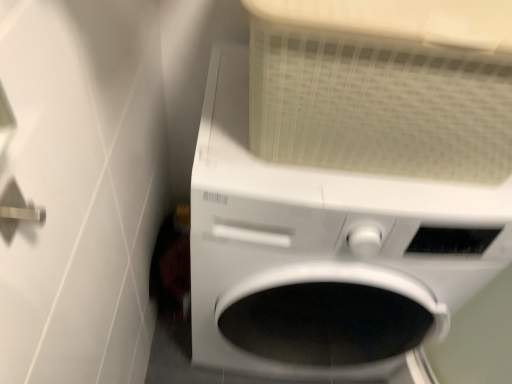
Question: From a real-world perspective, is silver metallic door handle at upper left physically above white matte washing machine at center?

Choices:
 (A) no
 (B) yes

Answer: (B)

Question: Does silver metallic door handle at upper left appear on the right side of white matte washing machine at center?

Choices:
 (A) yes
 (B) no

Answer: (B)

Question: Can you confirm if silver metallic door handle at upper left is positioned to the left of white matte washing machine at center?

Choices:
 (A) no
 (B) yes

Answer: (B)

Question: From the image's perspective, is silver metallic door handle at upper left on white matte washing machine at center?

Choices:
 (A) yes
 (B) no

Answer: (A)

Question: Are silver metallic door handle at upper left and white matte washing machine at center far apart?

Choices:
 (A) yes
 (B) no

Answer: (B)

Question: Is the depth of silver metallic door handle at upper left less than that of white matte washing machine at center?

Choices:
 (A) yes
 (B) no

Answer: (A)

Question: Does white matte washing machine at center contain silver metallic door handle at upper left?

Choices:
 (A) yes
 (B) no

Answer: (B)

Question: Does white matte washing machine at center have a smaller size compared to silver metallic door handle at upper left?

Choices:
 (A) no
 (B) yes

Answer: (A)

Question: From a real-world perspective, is white matte washing machine at center physically above silver metallic door handle at upper left?

Choices:
 (A) no
 (B) yes

Answer: (A)

Question: Is white matte washing machine at center taller than silver metallic door handle at upper left?

Choices:
 (A) yes
 (B) no

Answer: (A)

Question: Is white matte washing machine at center far from silver metallic door handle at upper left?

Choices:
 (A) no
 (B) yes

Answer: (A)

Question: From the image's perspective, does white matte washing machine at center appear higher than silver metallic door handle at upper left?

Choices:
 (A) yes
 (B) no

Answer: (B)

Question: From a real-world perspective, is silver metallic door handle at upper left positioned above or below white matte washing machine at center?

Choices:
 (A) above
 (B) below

Answer: (A)